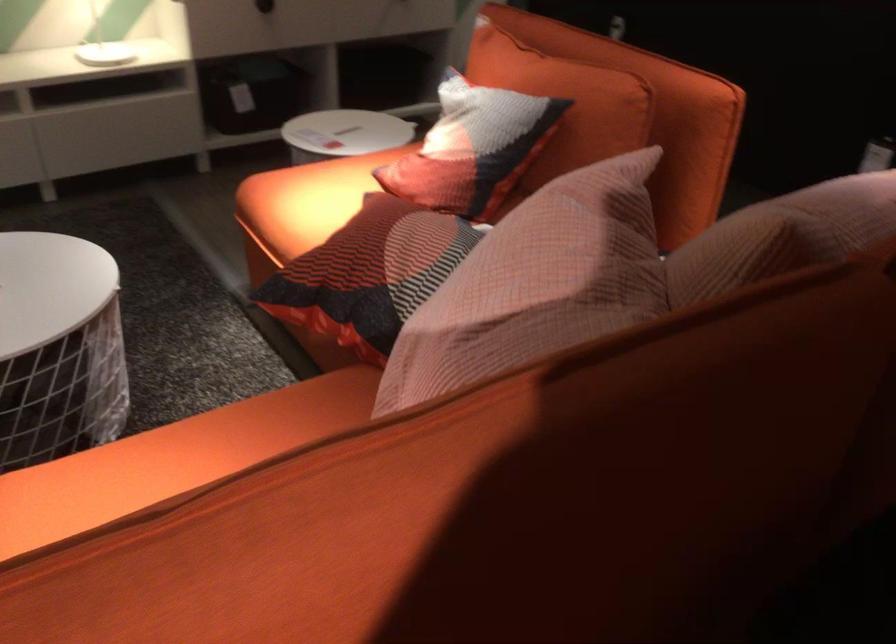
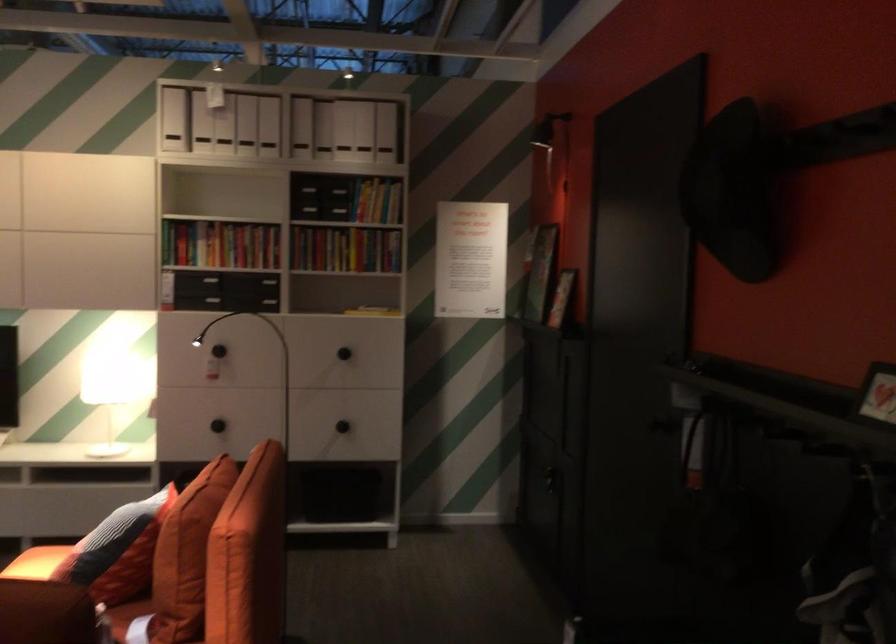
The point at (548, 142) is marked in the first image. Where is the corresponding point in the second image?

(117, 551)